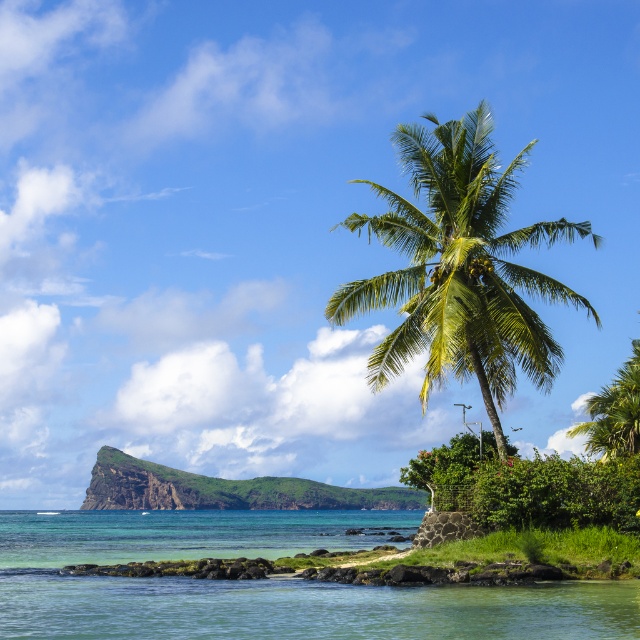
You are a photographer planning to capture the clear blue water at lower left and the green rocky island at center in a single shot. Based on the scene, which of these two elements will appear taller in the photograph?

The clear blue water at lower left appears taller in the photograph because it has a greater height compared to the green rocky island at center according to the description.

Looking at this image, you are a bird flying over the tropical coastal scene. You see the green leafy coconut tree at center and the green rocky island at center. Which one is higher from the ground?

The green leafy coconut tree at center is located above the green rocky island at center, so the green leafy coconut tree at center is higher from the ground.